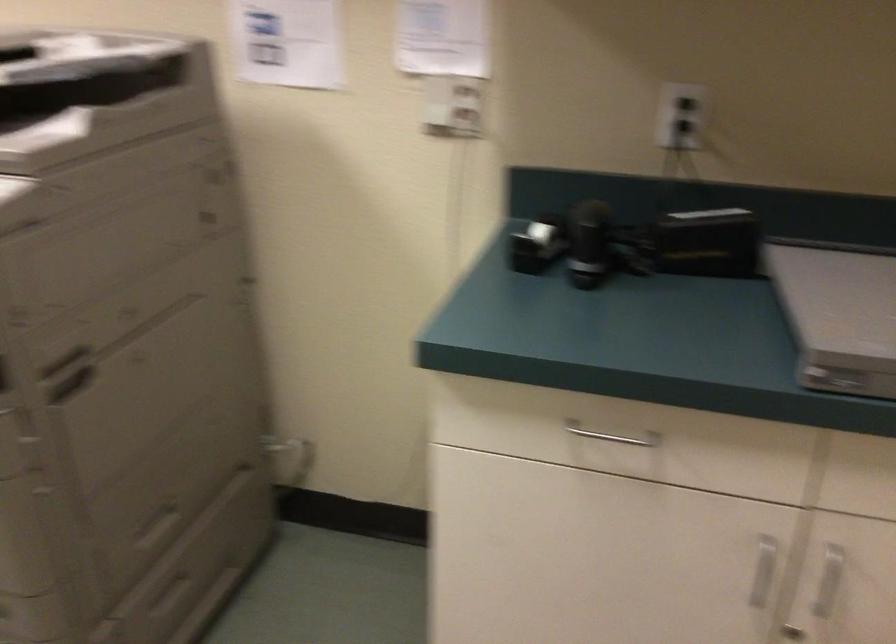
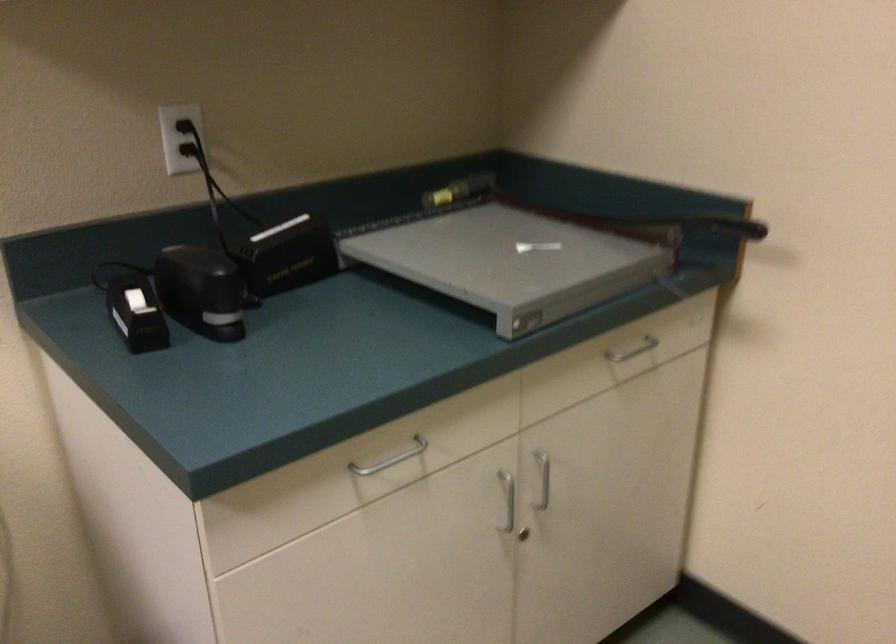
Where in the second image is the point corresponding to (712,232) from the first image?

(293, 247)